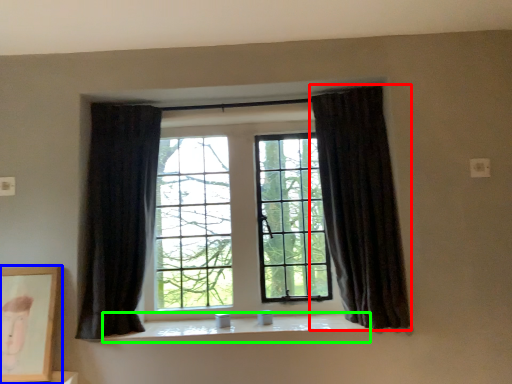
Question: Considering the real-world distances, which object is closest to curtain (highlighted by a red box)? picture frame (highlighted by a blue box) or window sill (highlighted by a green box).

Choices:
 (A) picture frame
 (B) window sill

Answer: (B)